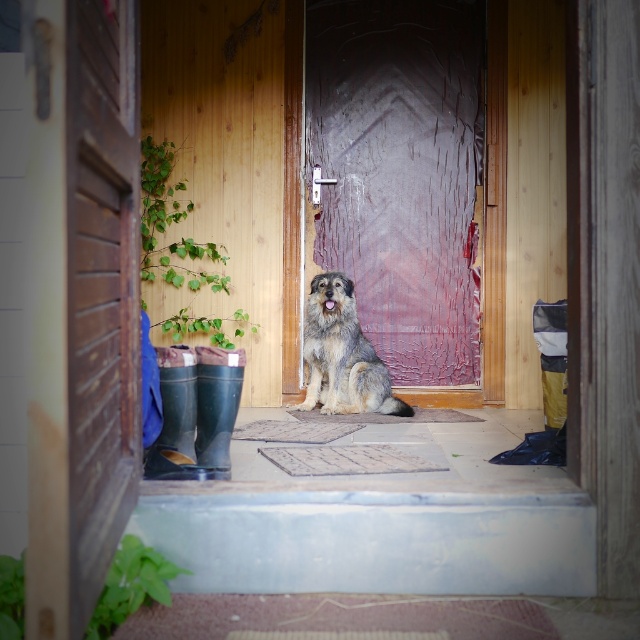
What is the significance of the point at coordinates (100, 288) in the image?

The point at coordinates (100, 288) marks the location of the rustic wood door at left.